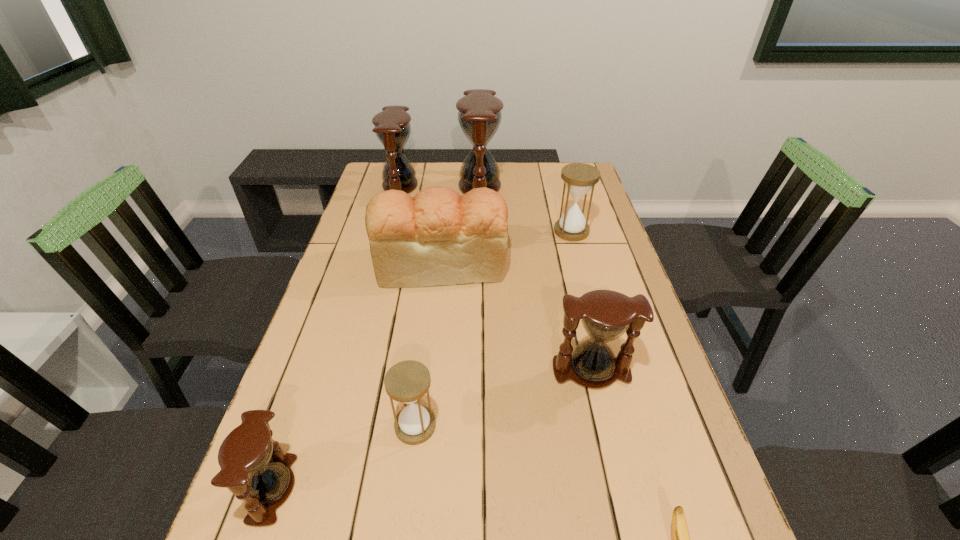
I want to click on the tallest object, so [x=479, y=112].

Locate an element on the screen. Image resolution: width=960 pixels, height=540 pixels. the tallest hourglass is located at coordinates tap(479, 112).

Image resolution: width=960 pixels, height=540 pixels. Find the location of `the second biggest brown hourglass`. the second biggest brown hourglass is located at coordinates (392, 127).

Identify the location of the fourth farthest object. (438, 237).

The image size is (960, 540). In order to click on the right white hourglass in this screenshot , I will do `click(579, 178)`.

You are a GUI agent. You are given a task and a screenshot of the screen. Output one action in this format:
    pyautogui.click(x=<x>, y=<y>)
    Task: Click on the fourth nearest hourglass
    The height and width of the screenshot is (540, 960).
    Given the screenshot: What is the action you would take?
    pyautogui.click(x=579, y=178)

Locate an element on the screen. This screenshot has height=540, width=960. the rightmost brown hourglass is located at coordinates (606, 315).

This screenshot has width=960, height=540. In order to click on the second nearest brown hourglass in this screenshot , I will do `click(606, 315)`.

Where is `the left white hourglass`? The height and width of the screenshot is (540, 960). the left white hourglass is located at coordinates (407, 381).

Identify the location of the third nearest object. (407, 381).